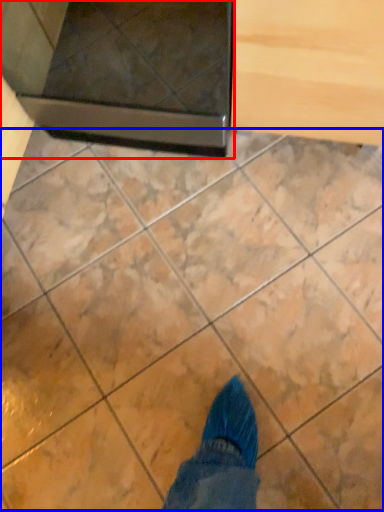
Question: Which of the following is the farthest to the observer, appliance (highlighted by a red box) or marble (highlighted by a blue box)?

Choices:
 (A) appliance
 (B) marble

Answer: (B)